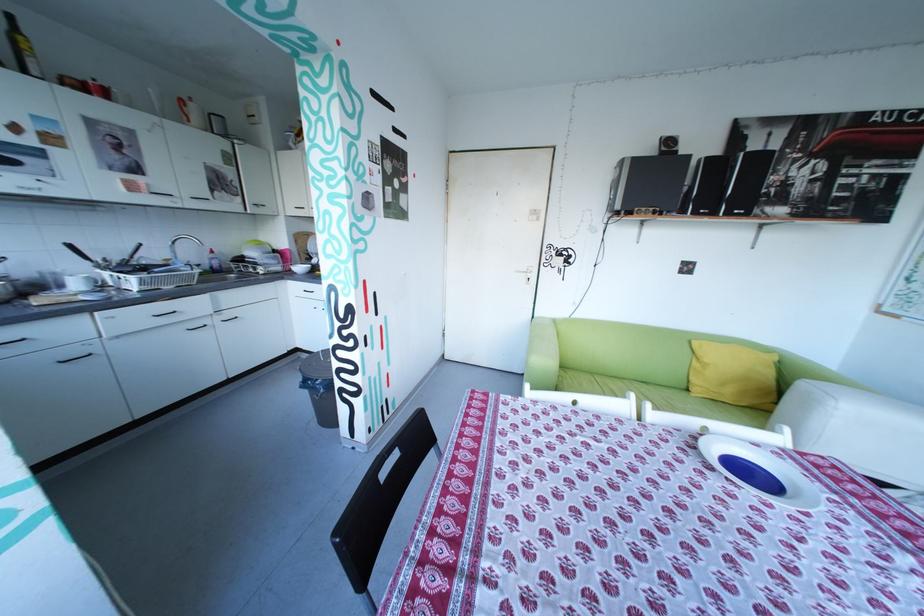
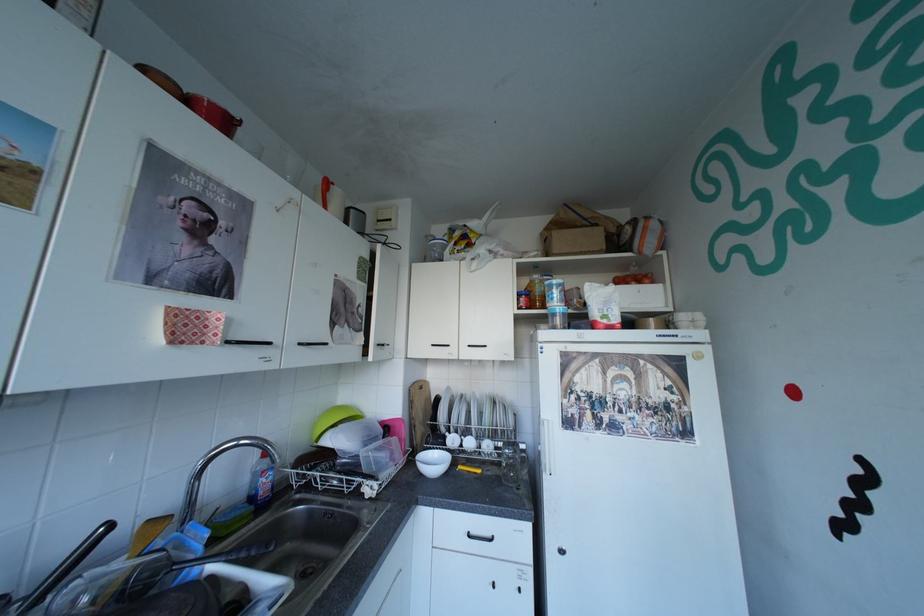
What movement of the cameraman would produce the second image?

The cameraman walked toward left, forward.